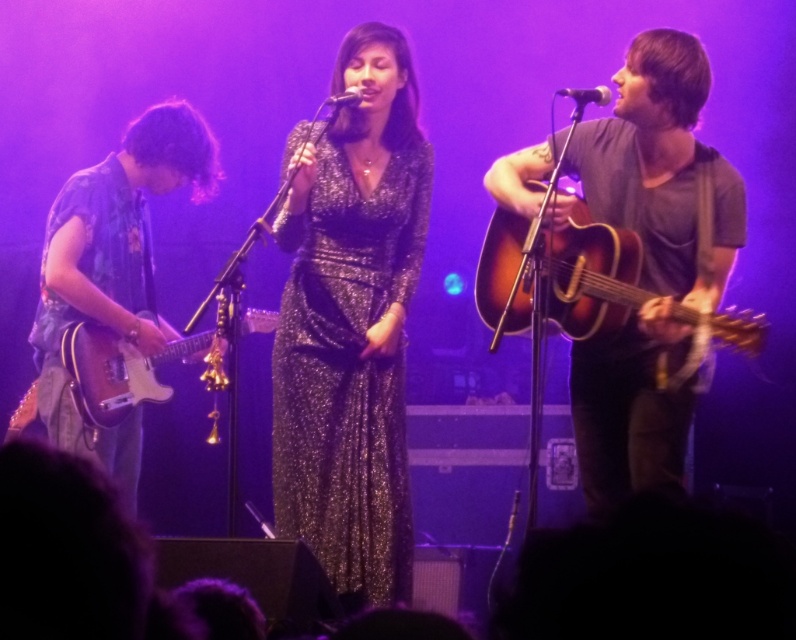
You are a stagehand and need to choose the microphone that is larger between the metallic silver microphone at upper right and the metallic silver microphone at center. Which one should you pick?

The metallic silver microphone at upper right is larger in size than the metallic silver microphone at center, so you should pick the metallic silver microphone at upper right.

You are standing in the audience and want to know how far the point at coordinates (674, 369) is from you. Can you determine the distance?

The distance of point (674, 369) from viewer is 8.92 feet.